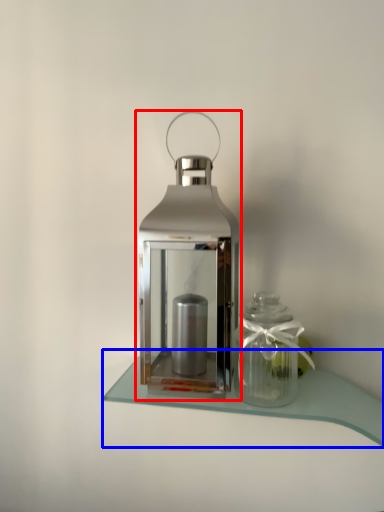
Question: Among these objects, which one is nearest to the camera, lantern (highlighted by a red box) or table (highlighted by a blue box)?

Choices:
 (A) lantern
 (B) table

Answer: (A)